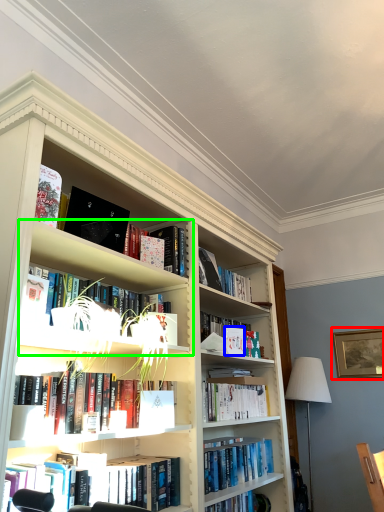
Question: Based on their relative distances, which object is nearer to picture frame (highlighted by a red box)? Choose from paperback book (highlighted by a blue box) and cabinet (highlighted by a green box).

Choices:
 (A) paperback book
 (B) cabinet

Answer: (A)